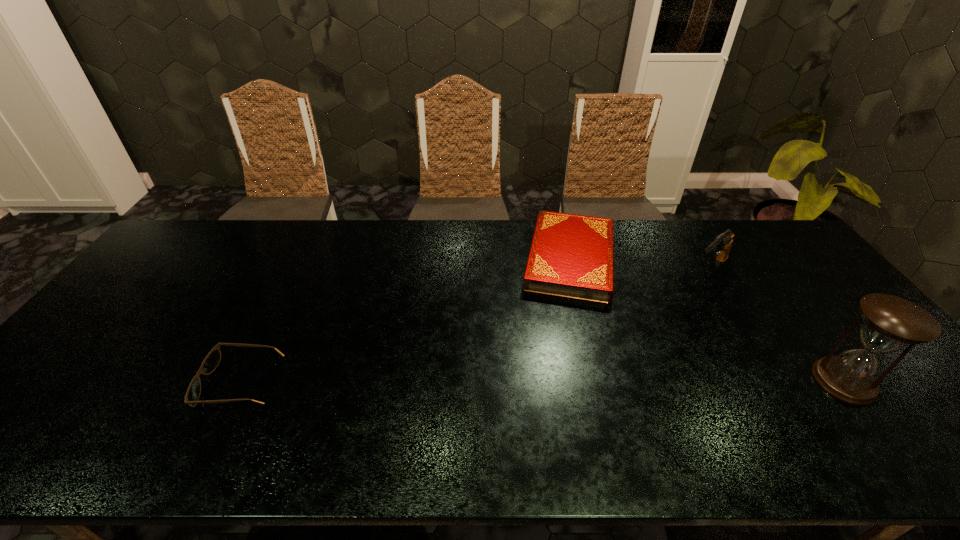
At what (x,y) coordinates should I click in order to perform the action: click on the leftmost object. Please return your answer as a coordinate pair (x, y). The image size is (960, 540). Looking at the image, I should click on (212, 360).

Where is `the tallest object`? The height and width of the screenshot is (540, 960). the tallest object is located at coordinates (890, 323).

Locate an element on the screen. Image resolution: width=960 pixels, height=540 pixels. the rightmost object is located at coordinates (890, 323).

You are a GUI agent. You are given a task and a screenshot of the screen. Output one action in this format:
    pyautogui.click(x=<x>, y=<y>)
    Task: Click on the second tallest object
    This screenshot has height=540, width=960.
    Given the screenshot: What is the action you would take?
    [x=722, y=244]

Where is `gun`? The image size is (960, 540). gun is located at coordinates (722, 244).

Where is `the third object from right to left`? Image resolution: width=960 pixels, height=540 pixels. the third object from right to left is located at coordinates (571, 256).

Locate an element on the screen. The width and height of the screenshot is (960, 540). vacant area situated 0.090m on the lenses of the sunglasses is located at coordinates (168, 383).

Find the location of a particular element. free space located 0.200m on the lenses of the sunglasses is located at coordinates (123, 383).

The image size is (960, 540). I want to click on vacant space located 0.280m on the lenses of the sunglasses, so [x=89, y=383].

Find the location of a particular element. This screenshot has height=540, width=960. blank area located 0.050m on the back of the tallest object is located at coordinates (815, 343).